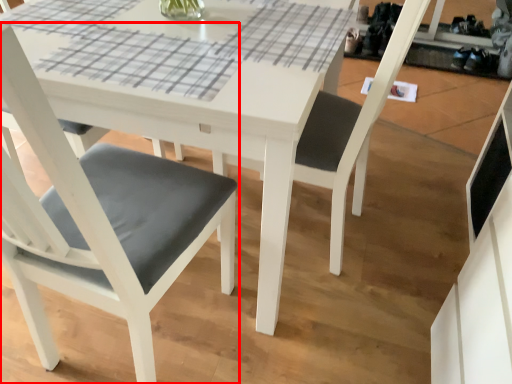
Question: From the image's perspective, considering the relative positions of chair (annotated by the red box) and chair in the image provided, where is chair (annotated by the red box) located with respect to the staircase?

Choices:
 (A) below
 (B) above

Answer: (B)